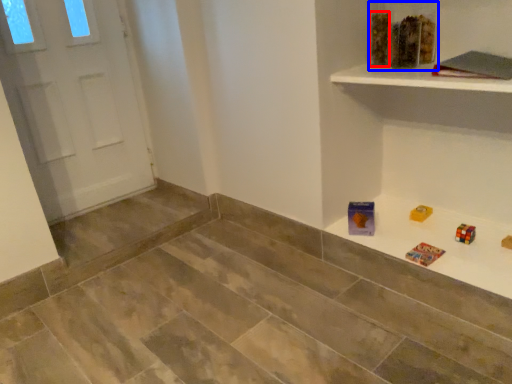
Question: Which object is further to the camera taking this photo, block (highlighted by a red box) or toy (highlighted by a blue box)?

Choices:
 (A) block
 (B) toy

Answer: (A)